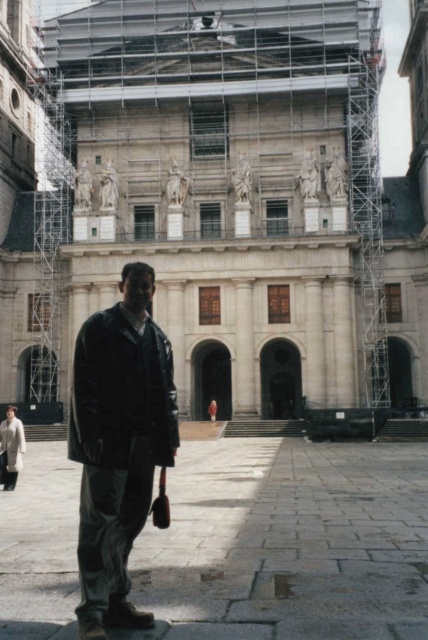
Question: Is white marble palace at center wider than smooth stone courtyard at center?

Choices:
 (A) no
 (B) yes

Answer: (B)

Question: Among these objects, which one is farthest from the camera?

Choices:
 (A) smooth stone courtyard at center
 (B) white marble palace at center
 (C) dark matte jacket at center

Answer: (B)

Question: Which point is farther to the camera?

Choices:
 (A) (98, 499)
 (B) (368, 262)
 (C) (329, 620)

Answer: (B)

Question: Estimate the real-world distances between objects in this image. Which object is closer to the white marble palace at center?

Choices:
 (A) smooth stone courtyard at center
 (B) dark matte jacket at center

Answer: (B)

Question: Can you confirm if white marble palace at center is positioned to the right of smooth stone courtyard at center?

Choices:
 (A) no
 (B) yes

Answer: (A)

Question: Does smooth stone courtyard at center appear over dark matte jacket at center?

Choices:
 (A) no
 (B) yes

Answer: (A)